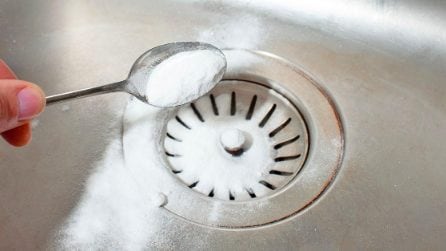
Where is `knob`? The image size is (446, 251). knob is located at coordinates (232, 138).